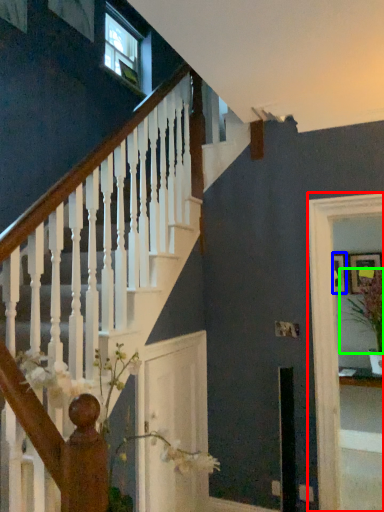
Question: Which object is positioned closest to glass door (highlighted by a red box)? Select from picture frame (highlighted by a blue box) and plant (highlighted by a green box).

Choices:
 (A) picture frame
 (B) plant

Answer: (B)